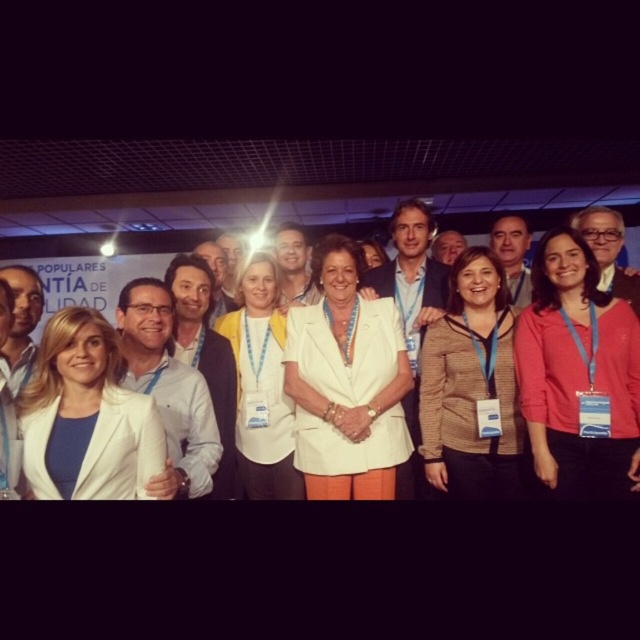
You are organizing a photoshoot and need to place a large prop behind the white matte blazer at left and the yellow fabric jacket at center. Which of the two items requires the prop to be placed further back to avoid blocking them?

The yellow fabric jacket at center requires the prop to be placed further back because it is larger than the white matte blazer at left.

You are a photographer trying to capture a closeup of the white matte blazer at left. Given that your camera has a focal length of 50mm and the blazer is at coordinates point 0.652, 0.136, can you determine if the blazer is within the camera frame?

The white matte blazer at left is located at point (86, 417), so yes, it is within the camera frame.

You are a photographer adjusting the lighting for a group photo. You notice the pink fabric shirt at center and the white matte blazer at center. Which clothing item is positioned higher on the person wearing them?

The pink fabric shirt at center is above the white matte blazer at center, so it is positioned higher on the person wearing them.